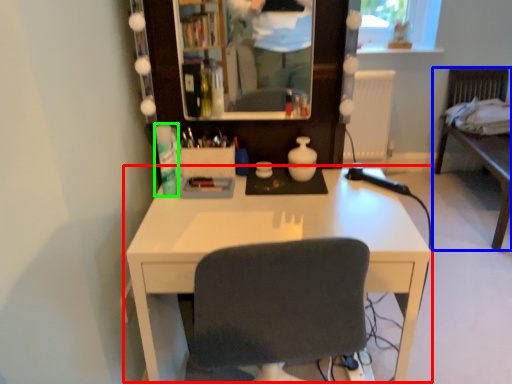
Question: Considering the real-world distances, which object is farthest from desk (highlighted by a red box)? furniture (highlighted by a blue box) or toiletry (highlighted by a green box)?

Choices:
 (A) furniture
 (B) toiletry

Answer: (A)